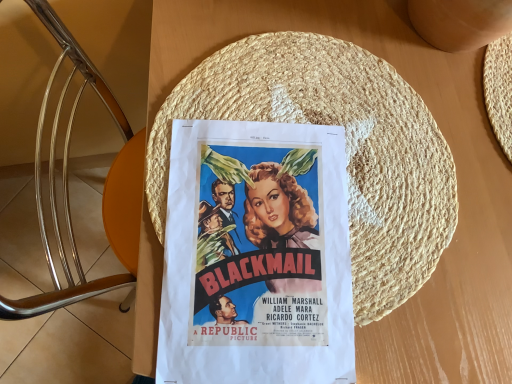
Find the location of a particular element. free space behind matte paper poster at center is located at coordinates click(x=335, y=89).